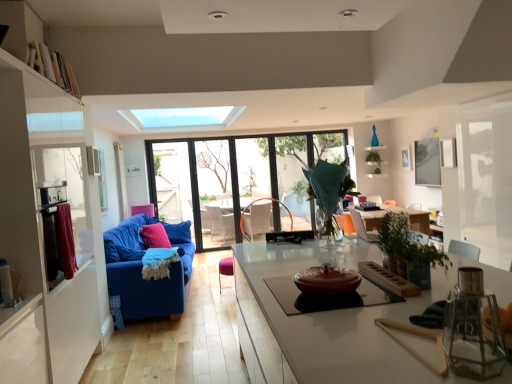
Question: From the image's perspective, is white fabric swivel chair at center above or below blue fabric couch at left?

Choices:
 (A) above
 (B) below

Answer: (B)

Question: Do you think white fabric swivel chair at center is within blue fabric couch at left, or outside of it?

Choices:
 (A) outside
 (B) inside

Answer: (A)

Question: Which object is positioned closest to the white wooden bookshelf at upper left?

Choices:
 (A) pink fabric pillow at center
 (B) white fabric swivel chair at center
 (C) green leafy plant at center, which is the 3th plant from left to right
 (D) blue fabric couch at left
 (E) transparent glass window at center

Answer: (D)

Question: Estimate the real-world distances between objects in this image. Which object is farther from the translucent glass vase at center, which appears as the 3th plant when viewed from the right?

Choices:
 (A) white fabric swivel chair at center
 (B) maroon fabric curtain at left
 (C) green matte plant at upper center, the second plant in the right-to-left sequence
 (D) white wooden bookshelf at upper left
 (E) velvet pink armchair at center, arranged as the first armchair when viewed from the right

Answer: (C)